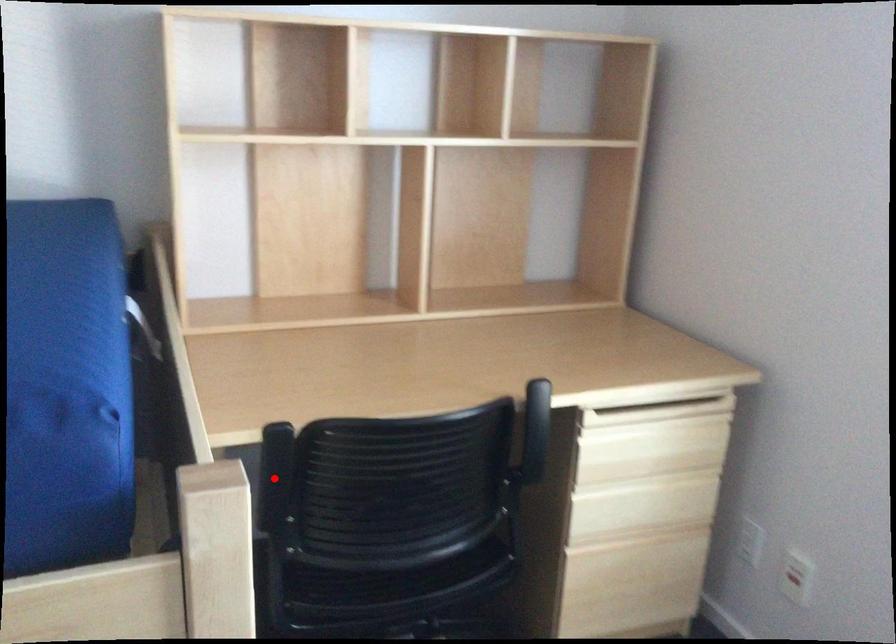
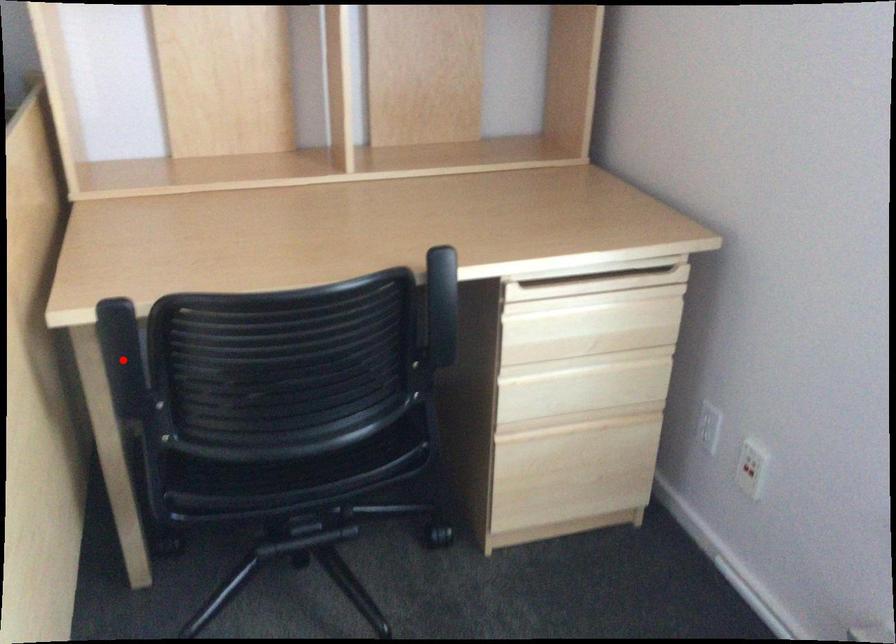
I am providing you with two images of the same scene from different viewpoints. A red point is marked on the first image and another point is marked on the second image. Is the red point in image1 aligned with the point shown in image2?

Yes